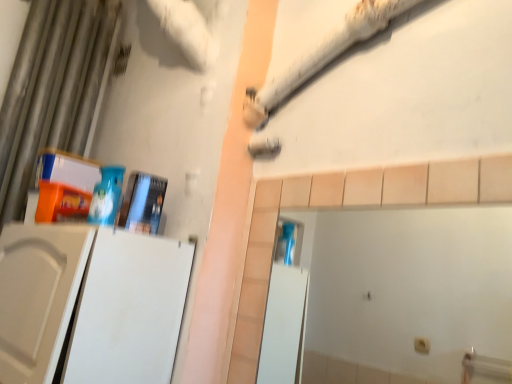
Describe the element at coordinates (129, 310) in the screenshot. This screenshot has width=512, height=384. I see `white matte screen door at left` at that location.

This screenshot has width=512, height=384. Find the location of `white matte screen door at left`. white matte screen door at left is located at coordinates (129, 310).

Where is `white matte screen door at left`? The image size is (512, 384). white matte screen door at left is located at coordinates (129, 310).